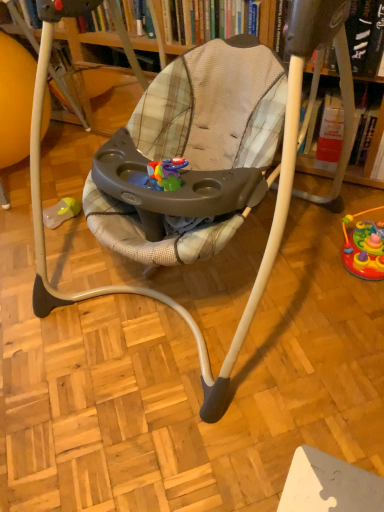
What are the coordinates of `vacant area that lies between plaid fabric baby swing at center and rubberized plastic toy at lower right` in the screenshot? It's located at (317, 332).